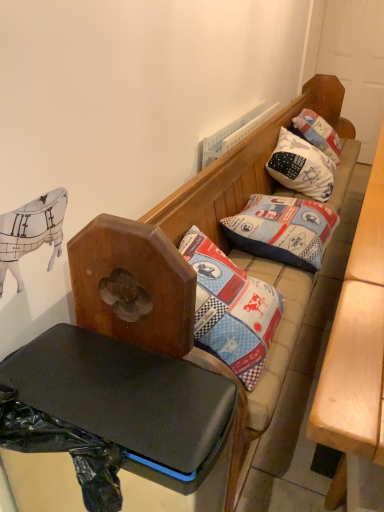
Describe the element at coordinates (117, 405) in the screenshot. This screenshot has height=512, width=384. I see `black plastic table at lower left, which appears as the second table when viewed from the right` at that location.

The height and width of the screenshot is (512, 384). Describe the element at coordinates (301, 167) in the screenshot. I see `white cotton pillow at upper right, acting as the second pillow starting from the front` at that location.

Identify the location of black plastic table at lower left, the first table positioned from the left. This screenshot has height=512, width=384. (117, 405).

What's the angular difference between light brown wooden table at right, the 2th table positioned from the left, and black plastic table at lower left, the first table positioned from the left,'s facing directions?

The angular difference between light brown wooden table at right, the 2th table positioned from the left, and black plastic table at lower left, the first table positioned from the left, is 90.5 degrees.

The height and width of the screenshot is (512, 384). What are the coordinates of `table behind the light brown wooden table at right, the 2th table positioned from the left` in the screenshot? It's located at (117, 405).

Is light brown wooden table at right, the 1th table from the right, looking in the opposite direction of black plastic table at lower left, which appears as the second table when viewed from the right?

Correct, light brown wooden table at right, the 1th table from the right, is looking away from black plastic table at lower left, which appears as the second table when viewed from the right.

From a real-world perspective, is light brown wooden table at right, the 2th table positioned from the left, physically located above or below black plastic table at lower left, the first table positioned from the left?

In terms of real-world spatial position, light brown wooden table at right, the 2th table positioned from the left, is above black plastic table at lower left, the first table positioned from the left.

From the image's perspective, is white cotton pillow at upper right, marked as the 1th pillow in a back-to-front arrangement, above or below light brown wooden table at right, the 2th table positioned from the left?

white cotton pillow at upper right, marked as the 1th pillow in a back-to-front arrangement, is situated higher than light brown wooden table at right, the 2th table positioned from the left, in the image.

Which point is more forward, [332,185] or [358,317]?

Positioned in front is point [358,317].

Is white cotton pillow at upper right, acting as the second pillow starting from the front, far from light brown wooden table at right, the 1th table from the right?

No, white cotton pillow at upper right, acting as the second pillow starting from the front, is in close proximity to light brown wooden table at right, the 1th table from the right.

How distant is white cotton pillow at upper right, marked as the 1th pillow in a back-to-front arrangement, from light brown wooden table at right, the 1th table from the right?

70.76 centimeters.

Who is more distant, white cotton pillow at upper right, acting as the second pillow starting from the front, or patchwork fabric pillow at center, positioned as the 1th pillow in front-to-back order?

white cotton pillow at upper right, acting as the second pillow starting from the front, is further from the camera.

Between white cotton pillow at upper right, marked as the 1th pillow in a back-to-front arrangement, and patchwork fabric pillow at center, arranged as the 2th pillow when viewed from the back, which one has smaller size?

patchwork fabric pillow at center, arranged as the 2th pillow when viewed from the back.

Identify the location of pillow in front of the white cotton pillow at upper right, marked as the 1th pillow in a back-to-front arrangement. (283, 230).

Looking at this image, could you measure the distance between white cotton pillow at upper right, acting as the second pillow starting from the front, and patchwork fabric pillow at center, arranged as the 2th pillow when viewed from the back?

The distance of white cotton pillow at upper right, acting as the second pillow starting from the front, from patchwork fabric pillow at center, arranged as the 2th pillow when viewed from the back, is 19.19 inches.

Which of these two, black plastic table at lower left, the first table positioned from the left, or patchwork fabric pillow at center, positioned as the 1th pillow in front-to-back order, is bigger?

black plastic table at lower left, the first table positioned from the left, is bigger.

Which is more to the left, black plastic table at lower left, the first table positioned from the left, or patchwork fabric pillow at center, positioned as the 1th pillow in front-to-back order?

black plastic table at lower left, the first table positioned from the left.

Is black plastic table at lower left, the first table positioned from the left, positioned with its back to patchwork fabric pillow at center, positioned as the 1th pillow in front-to-back order?

Yes, black plastic table at lower left, the first table positioned from the left, is facing away from patchwork fabric pillow at center, positioned as the 1th pillow in front-to-back order.

Considering the relative sizes of light brown wooden table at right, the 2th table positioned from the left, and patchwork fabric pillow at center, arranged as the 2th pillow when viewed from the back, in the image provided, is light brown wooden table at right, the 2th table positioned from the left, wider than patchwork fabric pillow at center, arranged as the 2th pillow when viewed from the back,?

No.

From a real-world perspective, which object rests below the other?

In real-world perspective, light brown wooden table at right, the 2th table positioned from the left, is lower.

Where is `table on the right side of patchwork fabric pillow at center, arranged as the 2th pillow when viewed from the back`? The image size is (384, 512). table on the right side of patchwork fabric pillow at center, arranged as the 2th pillow when viewed from the back is located at coordinates (356, 355).

What's the angular difference between light brown wooden table at right, the 2th table positioned from the left, and patchwork fabric pillow at center, arranged as the 2th pillow when viewed from the back,'s facing directions?

0.805 degrees separate the facing orientations of light brown wooden table at right, the 2th table positioned from the left, and patchwork fabric pillow at center, arranged as the 2th pillow when viewed from the back.

Considering the relative positions of patchwork fabric pillow at center, arranged as the 2th pillow when viewed from the back, and light brown wooden table at right, the 1th table from the right, in the image provided, is patchwork fabric pillow at center, arranged as the 2th pillow when viewed from the back, behind light brown wooden table at right, the 1th table from the right,?

That is True.

Choose the correct answer: Is patchwork fabric pillow at center, positioned as the 1th pillow in front-to-back order, inside light brown wooden table at right, the 2th table positioned from the left, or outside it?

patchwork fabric pillow at center, positioned as the 1th pillow in front-to-back order, is not inside light brown wooden table at right, the 2th table positioned from the left, it's outside.

Are patchwork fabric pillow at center, arranged as the 2th pillow when viewed from the back, and light brown wooden table at right, the 2th table positioned from the left, far apart?

That's not correct — patchwork fabric pillow at center, arranged as the 2th pillow when viewed from the back, is a little close to light brown wooden table at right, the 2th table positioned from the left.

Consider the image. Is patchwork fabric pillow at center, arranged as the 2th pillow when viewed from the back, shorter than black plastic table at lower left, the first table positioned from the left?

Indeed, patchwork fabric pillow at center, arranged as the 2th pillow when viewed from the back, has a lesser height compared to black plastic table at lower left, the first table positioned from the left.

Is patchwork fabric pillow at center, positioned as the 1th pillow in front-to-back order, not near black plastic table at lower left, the first table positioned from the left?

No, patchwork fabric pillow at center, positioned as the 1th pillow in front-to-back order, is not far away from black plastic table at lower left, the first table positioned from the left.

Is patchwork fabric pillow at center, positioned as the 1th pillow in front-to-back order, outside of black plastic table at lower left, the first table positioned from the left?

Yes, patchwork fabric pillow at center, positioned as the 1th pillow in front-to-back order, is outside of black plastic table at lower left, the first table positioned from the left.

Locate an element on the screen. The width and height of the screenshot is (384, 512). table that is on the left side of patchwork fabric pillow at center, positioned as the 1th pillow in front-to-back order is located at coordinates (117, 405).

Identify the location of table that appears behind the light brown wooden table at right, the 2th table positioned from the left. 117,405.

I want to click on the 2nd table in front of the white cotton pillow at upper right, marked as the 1th pillow in a back-to-front arrangement, counting from the anchor's position, so click(x=356, y=355).

Which object lies nearer to the anchor point black plastic table at lower left, the first table positioned from the left, light brown wooden table at right, the 2th table positioned from the left, or white cotton pillow at upper right, acting as the second pillow starting from the front?

light brown wooden table at right, the 2th table positioned from the left, lies closer to black plastic table at lower left, the first table positioned from the left, than the other object.

Estimate the real-world distances between objects in this image. Which object is closer to black plastic table at lower left, the first table positioned from the left, patchwork fabric pillow at center, positioned as the 1th pillow in front-to-back order, or white cotton pillow at upper right, marked as the 1th pillow in a back-to-front arrangement?

patchwork fabric pillow at center, positioned as the 1th pillow in front-to-back order.

When comparing their distances from patchwork fabric pillow at center, arranged as the 2th pillow when viewed from the back, does black plastic table at lower left, which appears as the second table when viewed from the right, or light brown wooden table at right, the 2th table positioned from the left, seem further?

The object further to patchwork fabric pillow at center, arranged as the 2th pillow when viewed from the back, is black plastic table at lower left, which appears as the second table when viewed from the right.

Based on their spatial positions, is black plastic table at lower left, which appears as the second table when viewed from the right, or white cotton pillow at upper right, marked as the 1th pillow in a back-to-front arrangement, further from light brown wooden table at right, the 2th table positioned from the left?

Among the two, white cotton pillow at upper right, marked as the 1th pillow in a back-to-front arrangement, is located further to light brown wooden table at right, the 2th table positioned from the left.

From the image, which object appears to be nearer to light brown wooden table at right, the 2th table positioned from the left, patchwork fabric pillow at center, arranged as the 2th pillow when viewed from the back, or black plastic table at lower left, which appears as the second table when viewed from the right?

patchwork fabric pillow at center, arranged as the 2th pillow when viewed from the back, is positioned closer to the anchor light brown wooden table at right, the 2th table positioned from the left.

Looking at the image, which one is located closer to white cotton pillow at upper right, marked as the 1th pillow in a back-to-front arrangement, light brown wooden table at right, the 2th table positioned from the left, or black plastic table at lower left, the first table positioned from the left?

The object closer to white cotton pillow at upper right, marked as the 1th pillow in a back-to-front arrangement, is light brown wooden table at right, the 2th table positioned from the left.

Considering their positions, is black plastic table at lower left, the first table positioned from the left, positioned closer to white cotton pillow at upper right, marked as the 1th pillow in a back-to-front arrangement, than light brown wooden table at right, the 2th table positioned from the left?

Among the two, light brown wooden table at right, the 2th table positioned from the left, is located nearer to white cotton pillow at upper right, marked as the 1th pillow in a back-to-front arrangement.

Estimate the real-world distances between objects in this image. Which object is closer to patchwork fabric pillow at center, positioned as the 1th pillow in front-to-back order, white cotton pillow at upper right, marked as the 1th pillow in a back-to-front arrangement, or light brown wooden table at right, the 2th table positioned from the left?

light brown wooden table at right, the 2th table positioned from the left, is closer to patchwork fabric pillow at center, positioned as the 1th pillow in front-to-back order.

Identify the location of pillow between black plastic table at lower left, the first table positioned from the left, and white cotton pillow at upper right, marked as the 1th pillow in a back-to-front arrangement, along the z-axis. (283, 230).

This screenshot has width=384, height=512. What are the coordinates of `pillow between light brown wooden table at right, the 2th table positioned from the left, and white cotton pillow at upper right, marked as the 1th pillow in a back-to-front arrangement, along the z-axis` in the screenshot? It's located at (283, 230).

You are a GUI agent. You are given a task and a screenshot of the screen. Output one action in this format:
    pyautogui.click(x=<x>, y=<y>)
    Task: Click on the table between light brown wooden table at right, the 2th table positioned from the left, and white cotton pillow at upper right, marked as the 1th pillow in a back-to-front arrangement, in the front-back direction
    
    Given the screenshot: What is the action you would take?
    pyautogui.click(x=117, y=405)